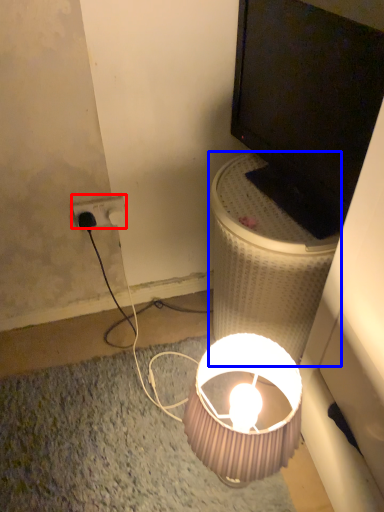
Question: Among these objects, which one is nearest to the camera, power outlet (highlighted by a red box) or table (highlighted by a blue box)?

Choices:
 (A) power outlet
 (B) table

Answer: (B)